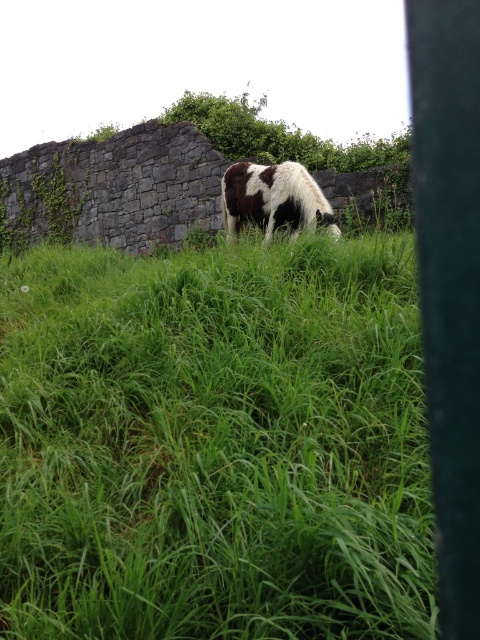
Question: Does green grass at center appear on the right side of spotted fur cow at center?

Choices:
 (A) no
 (B) yes

Answer: (A)

Question: Does green grass at center appear on the right side of spotted fur cow at center?

Choices:
 (A) yes
 (B) no

Answer: (B)

Question: Which of the following is the closest to the observer?

Choices:
 (A) (260, 198)
 (B) (164, 454)

Answer: (B)

Question: Can you confirm if green grass at center is positioned above spotted fur cow at center?

Choices:
 (A) yes
 (B) no

Answer: (B)